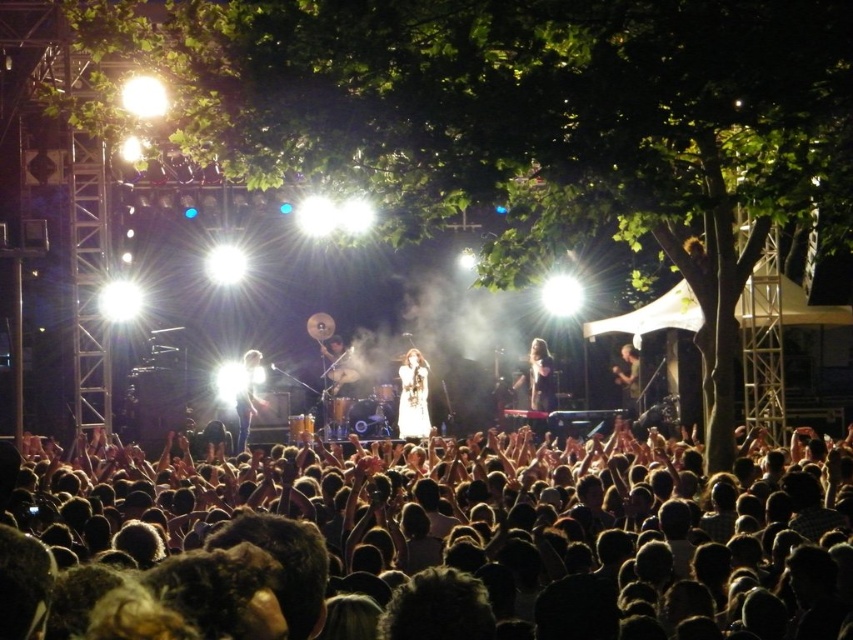
Question: From the image, what is the correct spatial relationship of dark brown hair at lower center in relation to shiny silver microphone at center?

Choices:
 (A) right
 (B) left

Answer: (A)

Question: Does dark brown hair at lower center appear over long hair at center?

Choices:
 (A) no
 (B) yes

Answer: (A)

Question: Can you confirm if shiny silver microphone at center is positioned below dark brown leather jacket at right?

Choices:
 (A) yes
 (B) no

Answer: (A)

Question: Which is farther from the long hair at center?

Choices:
 (A) dark brown hair at lower center
 (B) white lace dress at center

Answer: (A)

Question: Among these objects, which one is nearest to the camera?

Choices:
 (A) dark brown hair at lower center
 (B) shiny silver microphone at center
 (C) matte black guitar at center

Answer: (A)

Question: Which object is farther from the camera taking this photo?

Choices:
 (A) dark brown leather jacket at right
 (B) shiny silver microphone at center
 (C) long hair at center

Answer: (C)